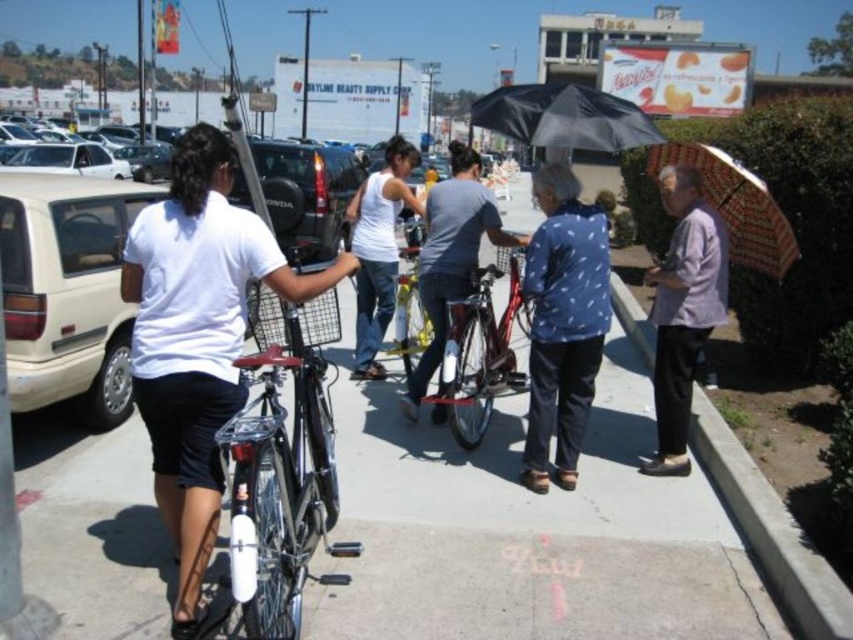
Question: Observing the image, what is the correct spatial positioning of blue printed shirt at center in reference to black matte umbrella at upper center?

Choices:
 (A) below
 (B) above

Answer: (A)

Question: Which point is closer to the camera?

Choices:
 (A) (383, 269)
 (B) (735, 186)
 (C) (724, 518)
 (D) (556, 120)

Answer: (C)

Question: Among these points, which one is farthest from the camera?

Choices:
 (A) (502, 115)
 (B) (807, 616)
 (C) (747, 221)
 (D) (316, 417)

Answer: (C)

Question: Does concrete sidewalk at center appear over white matte shirt at center?

Choices:
 (A) yes
 (B) no

Answer: (B)

Question: Which object is positioned farthest from the white matte tank top at center?

Choices:
 (A) concrete at right
 (B) white matte shirt at center

Answer: (B)

Question: Where is white matte shirt at center located in relation to purple cotton shirt at right in the image?

Choices:
 (A) left
 (B) right

Answer: (A)